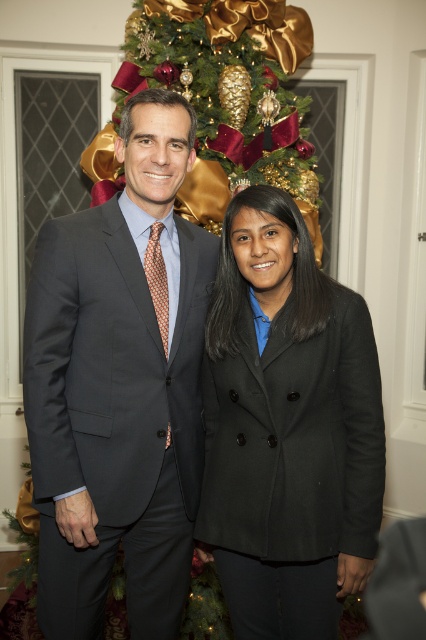
Question: Among these points, which one is farthest from the camera?

Choices:
 (A) (134, 157)
 (B) (247, 86)

Answer: (B)

Question: Is black wool coat at center above green textured christmas tree at upper center?

Choices:
 (A) yes
 (B) no

Answer: (B)

Question: Is matte gray suit at center bigger than black wool coat at center?

Choices:
 (A) no
 (B) yes

Answer: (B)

Question: Which object appears farthest from the camera in this image?

Choices:
 (A) black wool coat at center
 (B) matte gray suit at center

Answer: (B)

Question: Which object is farther from the camera taking this photo?

Choices:
 (A) matte gray suit at center
 (B) black wool coat at center
 (C) green textured christmas tree at upper center

Answer: (C)

Question: Is matte gray suit at center thinner than green textured christmas tree at upper center?

Choices:
 (A) yes
 (B) no

Answer: (A)